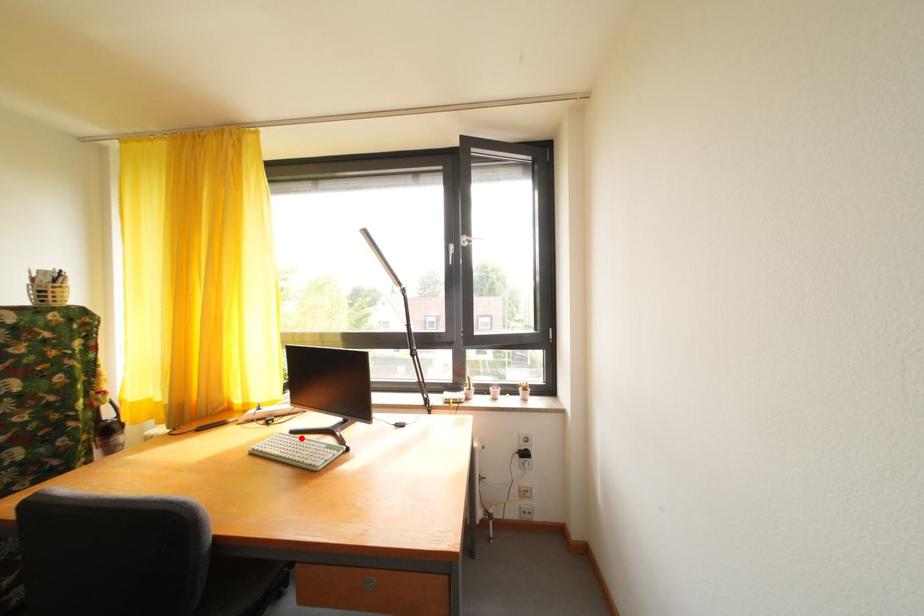
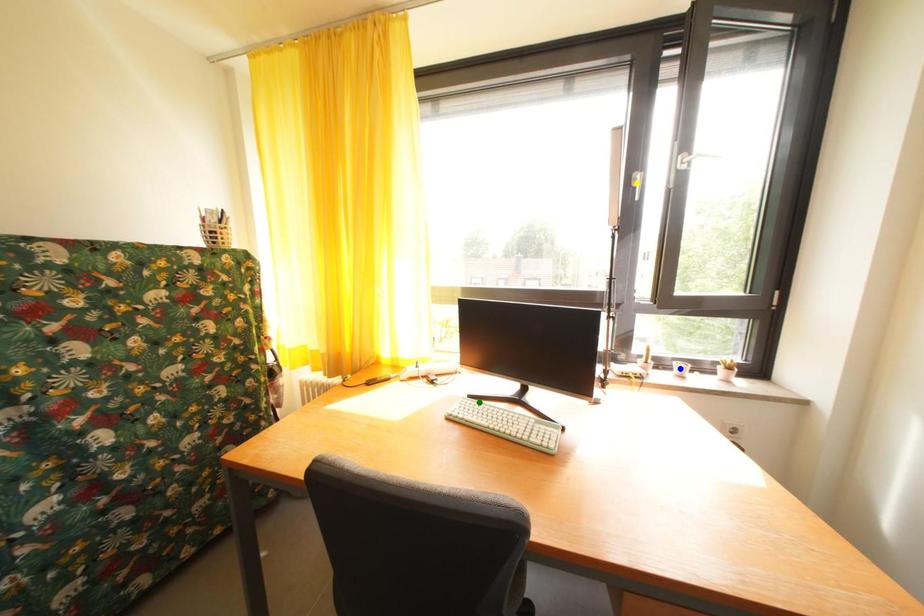
Question: I am providing you with two images of the same scene from different viewpoints. A red point is marked on the first image. You are given multiple points on the second image. Which spot in image 2 lines up with the point in image 1?

Choices:
 (A) blue point
 (B) green point
 (C) yellow point

Answer: (B)